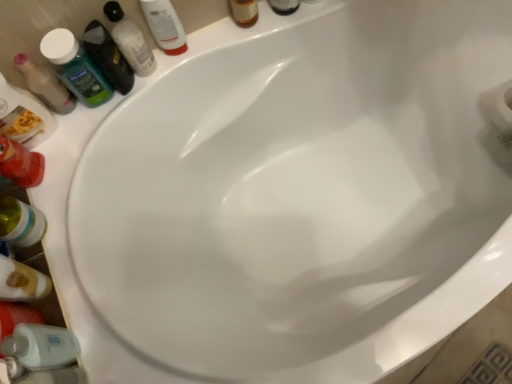
Question: From the image's perspective, is translucent plastic bottle at lower left above or below translucent plastic shampoo bottle at upper left, the first toiletry ordered from the bottom?

Choices:
 (A) above
 (B) below

Answer: (B)

Question: Is translucent plastic bottle at lower left situated inside translucent plastic shampoo bottle at upper left, which ranks as the 1th toiletry in left-to-right order, or outside?

Choices:
 (A) inside
 (B) outside

Answer: (B)

Question: Which object is positioned closest to the translucent amber bottle at upper center, marked as the 1th toiletry in a right-to-left arrangement?

Choices:
 (A) translucent plastic mouthwash at upper left, positioned as the 4th mouthwash in right-to-left order
 (B) translucent plastic mouthwash at upper left, which ranks as the second mouthwash in left-to-right order
 (C) green matte mouthwash at upper left, marked as the 3th mouthwash in a left-to-right arrangement
 (D) translucent plastic bottle at lower left
 (E) translucent plastic shampoo bottle at upper left, the second toiletry viewed from the top

Answer: (C)

Question: Based on their relative distances, which object is nearer to the translucent plastic mouthwash at upper left, the 3th mouthwash viewed from the right?

Choices:
 (A) translucent plastic shampoo bottle at upper left, the second toiletry viewed from the top
 (B) translucent plastic mouthwash at upper left, positioned as the 4th mouthwash in right-to-left order
 (C) translucent amber bottle at upper center, the second toiletry from the left
 (D) translucent plastic bottle at lower left
 (E) green matte mouthwash at upper left, placed as the second mouthwash when sorted from right to left

Answer: (A)